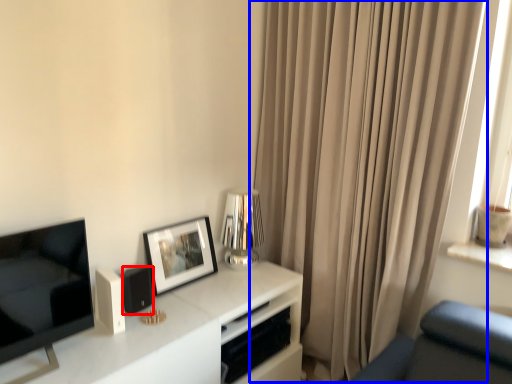
Question: Among these objects, which one is farthest to the camera, speaker (highlighted by a red box) or curtain (highlighted by a blue box)?

Choices:
 (A) speaker
 (B) curtain

Answer: (A)